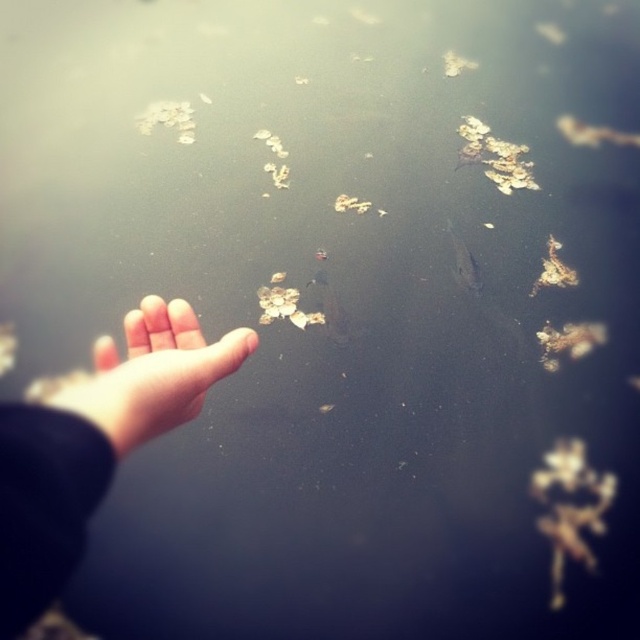
Can you confirm if brown leafy debris at upper center is bigger than brown organic matter at center?

Correct, brown leafy debris at upper center is larger in size than brown organic matter at center.

Is brown leafy debris at upper center positioned at the back of brown organic matter at center?

Yes, brown leafy debris at upper center is further from the viewer.

Between point (525, 179) and point (548, 278), which one is positioned behind?

Point (525, 179)

In order to click on brown leafy debris at upper center in this screenshot , I will do `click(496, 156)`.

Is the position of skinny flesh at left more distant than that of brown leafy debris at upper center?

No, skinny flesh at left is in front of brown leafy debris at upper center.

What do you see at coordinates (93, 444) in the screenshot?
I see `skinny flesh at left` at bounding box center [93, 444].

Find the location of a particular element. skinny flesh at left is located at coordinates (93, 444).

Is the position of skinny flesh at left less distant than that of pale skin hand at lower left?

Yes, it is.

Who is higher up, skinny flesh at left or pale skin hand at lower left?

pale skin hand at lower left is higher up.

Which is in front, point (188, 372) or point (104, 353)?

Point (188, 372) is more forward.

Locate an element on the screen. This screenshot has width=640, height=640. skinny flesh at left is located at coordinates (93, 444).